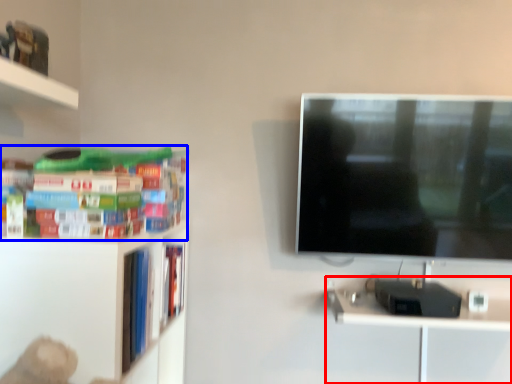
Question: Which object is further to the camera taking this photo, computer desk (highlighted by a red box) or book (highlighted by a blue box)?

Choices:
 (A) computer desk
 (B) book

Answer: (A)